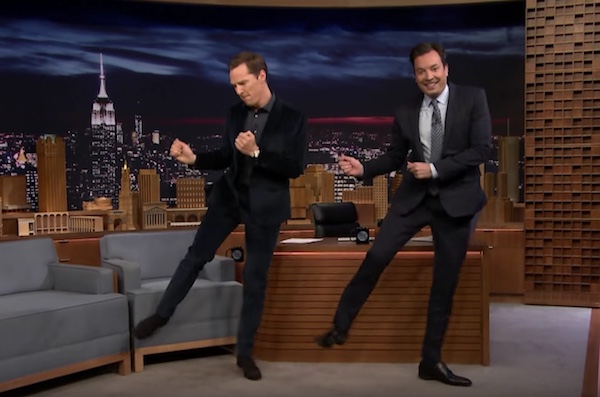
You are a GUI agent. You are given a task and a screenshot of the screen. Output one action in this format:
    pyautogui.click(x=<x>, y=<y>)
    Task: Click on the places to sit
    This screenshot has height=397, width=600.
    Given the screenshot: What is the action you would take?
    pyautogui.click(x=79, y=302), pyautogui.click(x=131, y=272), pyautogui.click(x=345, y=217)